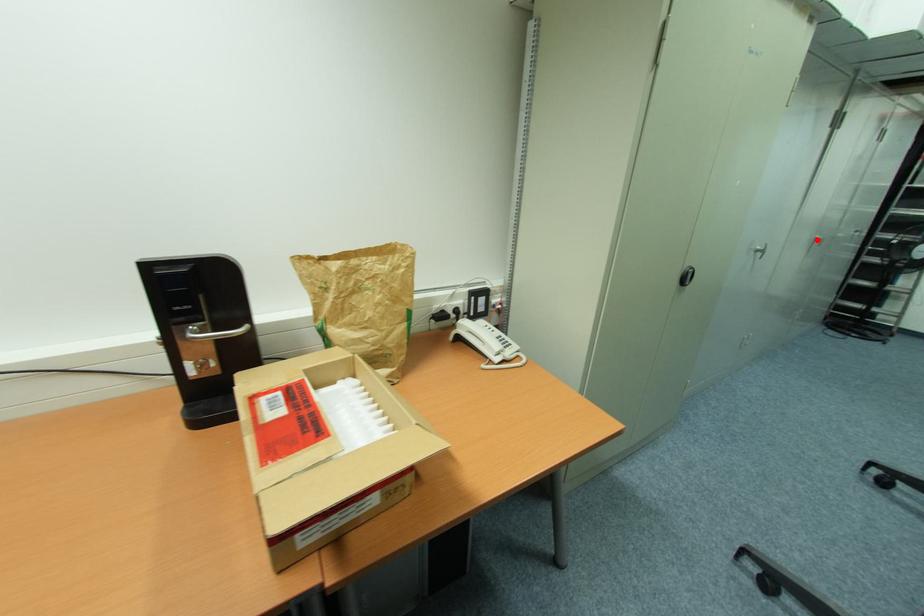
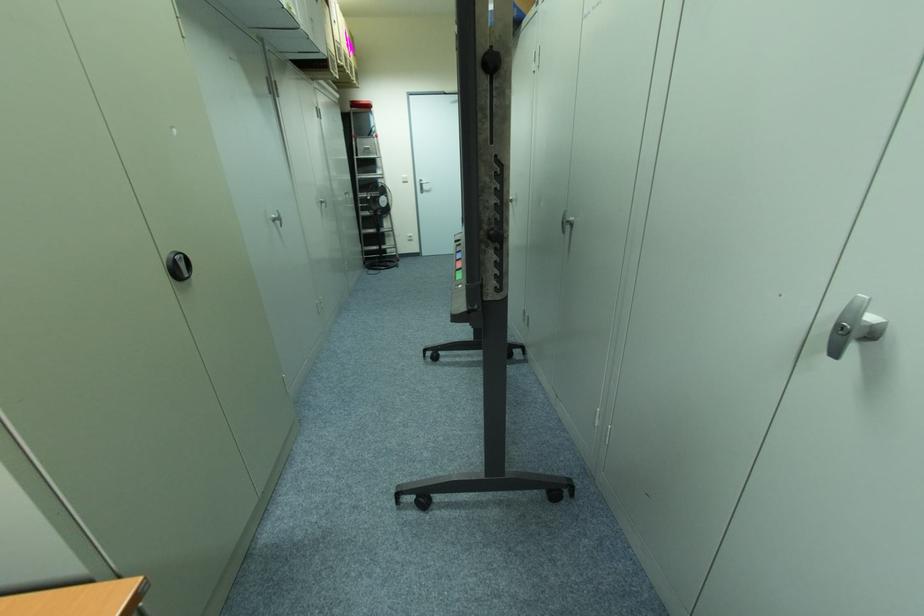
Question: A red point is marked in image1. In image2, is the corresponding 3D point closer to the camera or farther? Reply with the corresponding letter.

Choices:
 (A) The corresponding 3D point is closer.
 (B) The corresponding 3D point is farther.

Answer: (A)